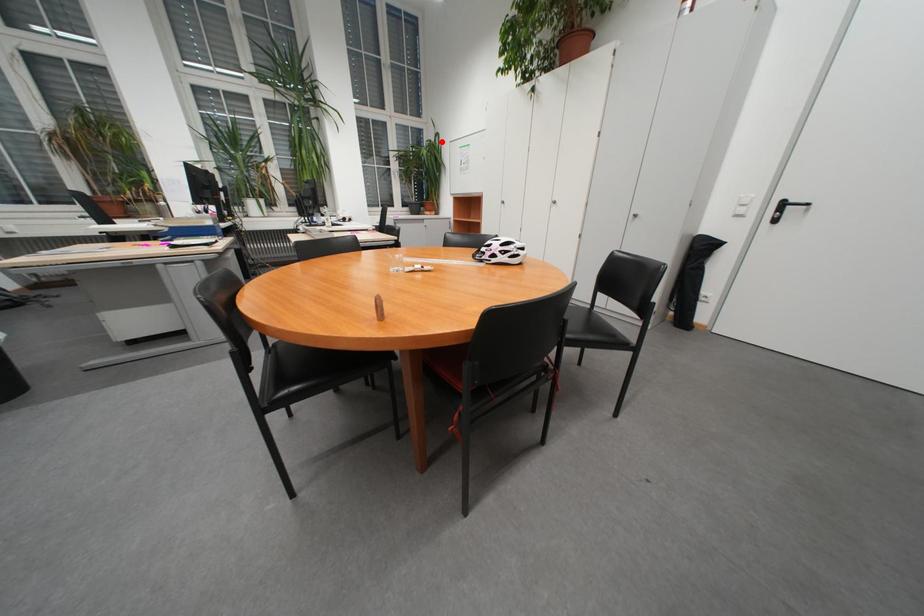
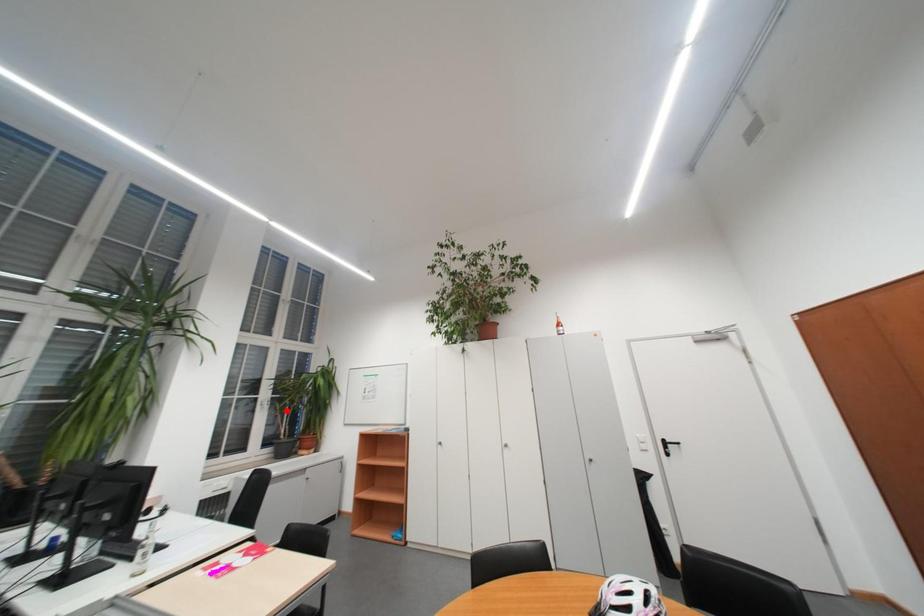
I am providing you with two images of the same scene from different viewpoints. A red point is marked on the first image and another point is marked on the second image. Are the points marked in image1 and image2 representing the same 3D position?

No